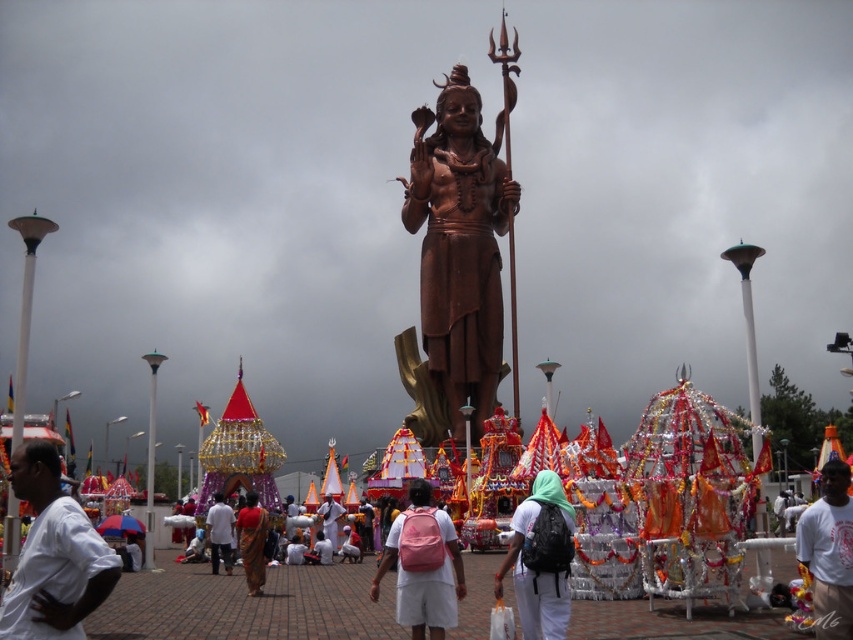
Who is shorter, pink fabric backpack at center or matte red sari at center?

matte red sari at center

Does pink fabric backpack at center have a lesser height compared to matte red sari at center?

No, pink fabric backpack at center is not shorter than matte red sari at center.

Who is more forward, (450, 557) or (256, 566)?

Point (450, 557) is in front.

Identify the location of pink fabric backpack at center. This screenshot has height=640, width=853. (422, 566).

Does bronze statue at center come behind white cotton shirt at center?

That is True.

How distant is bronze statue at center from white cotton shirt at center?

The distance of bronze statue at center from white cotton shirt at center is 151.18 feet.

Who is more forward, (485, 209) or (221, 548)?

Positioned in front is point (221, 548).

Where is `bronze statue at center`? This screenshot has width=853, height=640. bronze statue at center is located at coordinates (456, 262).

How much distance is there between white matte backpack at center and white t-shirt at center?

A distance of 25.40 meters exists between white matte backpack at center and white t-shirt at center.

Measure the distance between white matte backpack at center and camera.

white matte backpack at center is 303.65 feet away from camera.

This screenshot has width=853, height=640. What do you see at coordinates (540, 560) in the screenshot?
I see `white matte backpack at center` at bounding box center [540, 560].

At what (x,y) coordinates should I click in order to perform the action: click on white matte backpack at center. Please return your answer as a coordinate pair (x, y). Image resolution: width=853 pixels, height=640 pixels. Looking at the image, I should click on (540, 560).